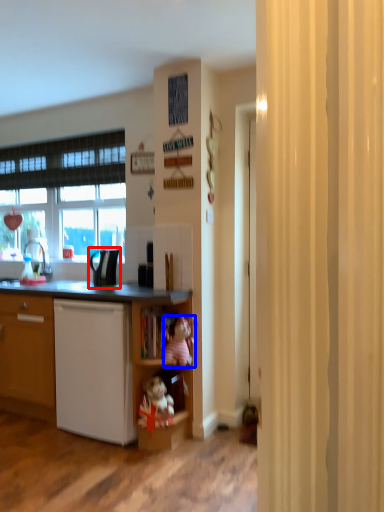
Question: Which point is further to the camera, appliance (highlighted by a red box) or toy (highlighted by a blue box)?

Choices:
 (A) appliance
 (B) toy

Answer: (A)